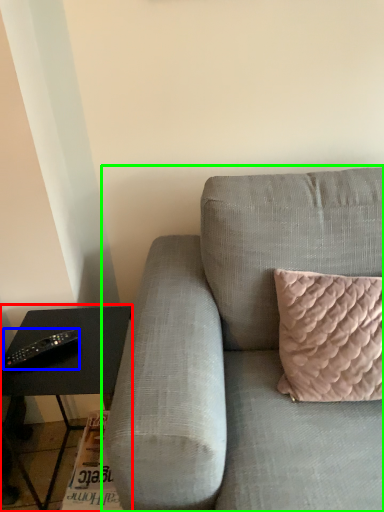
Question: Based on their relative distances, which object is nearer to table (highlighted by a red box)? Choose from remote (highlighted by a blue box) and studio couch (highlighted by a green box).

Choices:
 (A) remote
 (B) studio couch

Answer: (A)